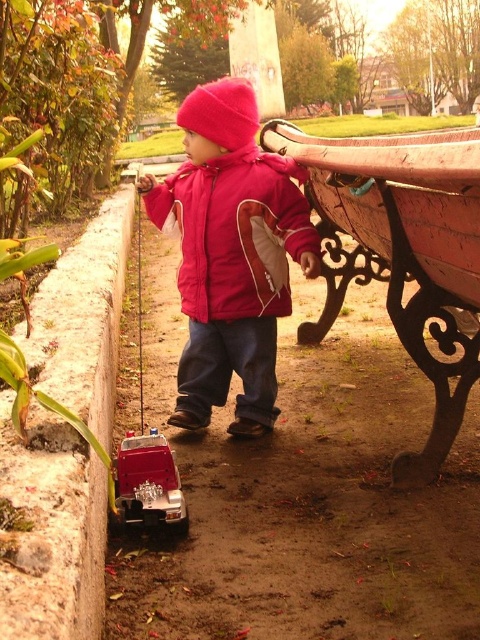
Who is more distant from viewer, (335, 147) or (276, 305)?

The point (276, 305) is more distant.

Looking at this image, is rustic wood bench at right below matte red jacket at center?

Yes.

Is point (419, 145) positioned behind point (276, 202)?

No, (419, 145) is closer to viewer.

I want to click on rustic wood bench at right, so click(402, 252).

Can you confirm if matte pink jacket at center is thinner than rustic wood bench at right?

Yes.

Between matte pink jacket at center and rustic wood bench at right, which one has less height?

matte pink jacket at center

Is point (259, 300) closer to camera compared to point (325, 156)?

That is False.

Where is `matte pink jacket at center`? The width and height of the screenshot is (480, 640). matte pink jacket at center is located at coordinates (230, 253).

Who is lower down, rustic wood bench at right or metallic red toy car at lower left?

metallic red toy car at lower left is below.

Does point (419, 365) come closer to viewer compared to point (130, 509)?

No, (419, 365) is further to viewer.

At what (x,y) coordinates should I click in order to perform the action: click on rustic wood bench at right. Please return your answer as a coordinate pair (x, y). Looking at the image, I should click on (402, 252).